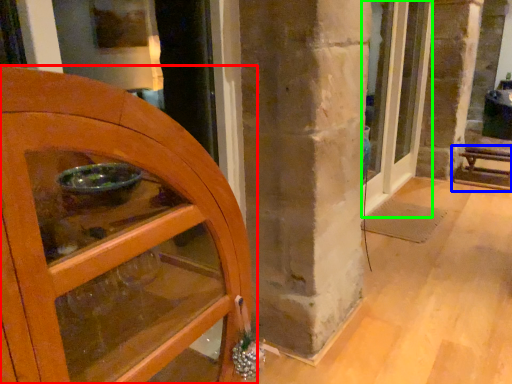
Question: Considering the real-world distances, which object is closest to door (highlighted by a red box)? furniture (highlighted by a blue box) or door (highlighted by a green box).

Choices:
 (A) furniture
 (B) door

Answer: (B)